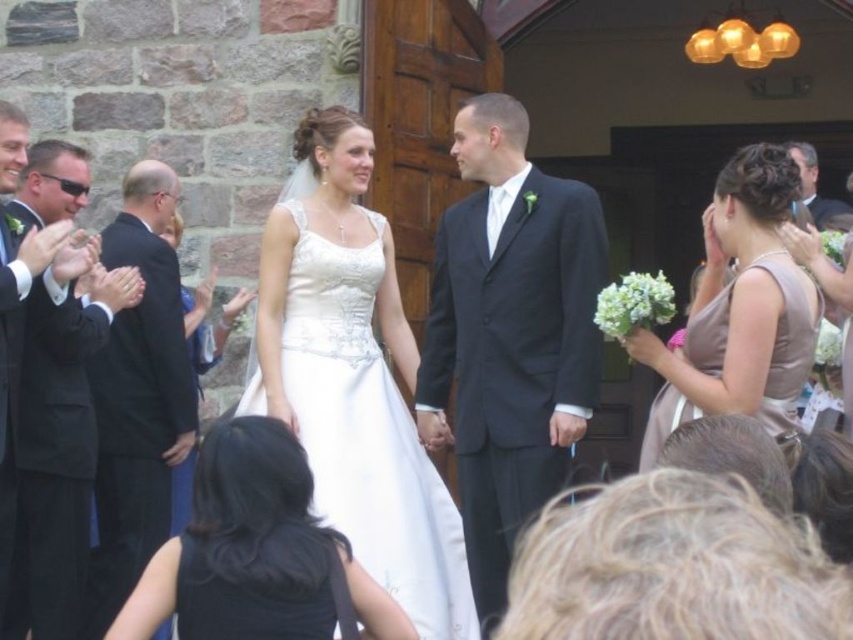
Is matte black suit at center bigger than black suit at left?

Indeed, matte black suit at center has a larger size compared to black suit at left.

How much distance is there between matte black suit at center and black suit at left?

They are 13.55 meters apart.

You are a GUI agent. You are given a task and a screenshot of the screen. Output one action in this format:
    pyautogui.click(x=<x>, y=<y>)
    Task: Click on the matte black suit at center
    This screenshot has width=853, height=640.
    Given the screenshot: What is the action you would take?
    pyautogui.click(x=509, y=336)

Can you confirm if black suit at left is positioned to the right of dark gray suit at upper right?

In fact, black suit at left is to the left of dark gray suit at upper right.

Who is higher up, black suit at left or dark gray suit at upper right?

dark gray suit at upper right is higher up.

Which is in front, point (135, 484) or point (809, 145)?

Point (135, 484) is more forward.

Locate an element on the screen. This screenshot has width=853, height=640. black suit at left is located at coordinates (138, 396).

Does black satin dress at center have a lesser width compared to dark gray suit at upper right?

Yes, black satin dress at center is thinner than dark gray suit at upper right.

You are a GUI agent. You are given a task and a screenshot of the screen. Output one action in this format:
    pyautogui.click(x=<x>, y=<y>)
    Task: Click on the black satin dress at center
    
    Given the screenshot: What is the action you would take?
    tap(257, 554)

Find the location of `black satin dress at center`. black satin dress at center is located at coordinates (257, 554).